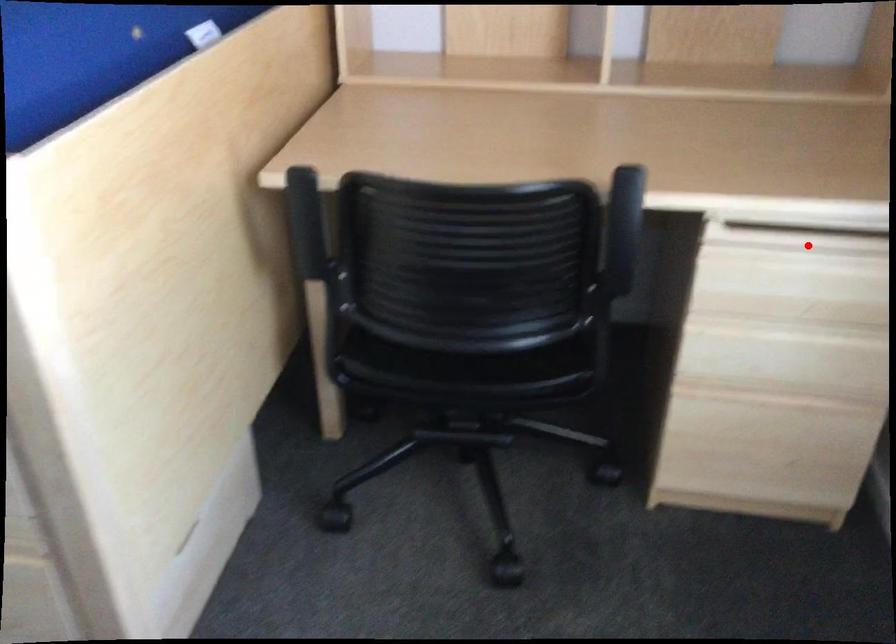
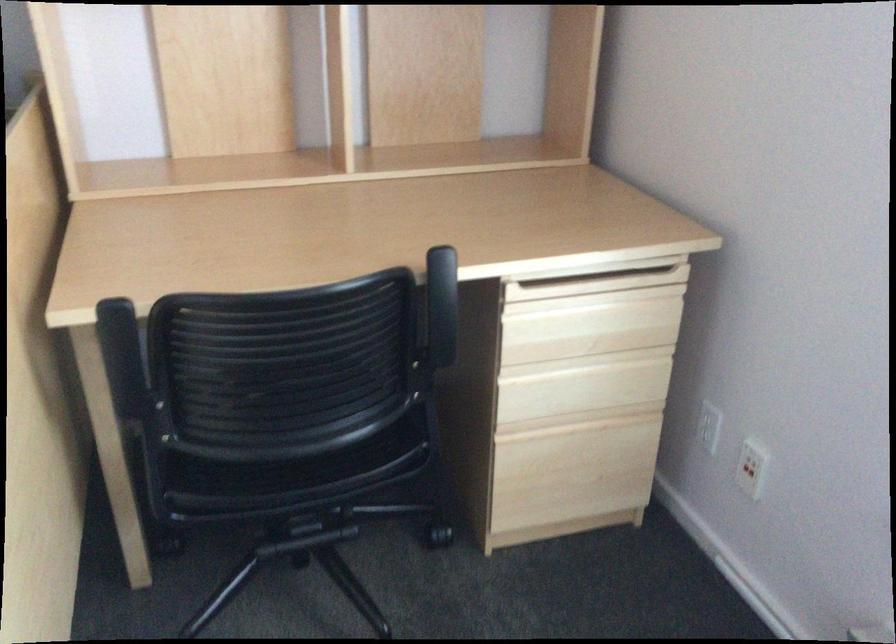
In the second image, find the point that corresponds to the highlighted location in the first image.

(587, 286)